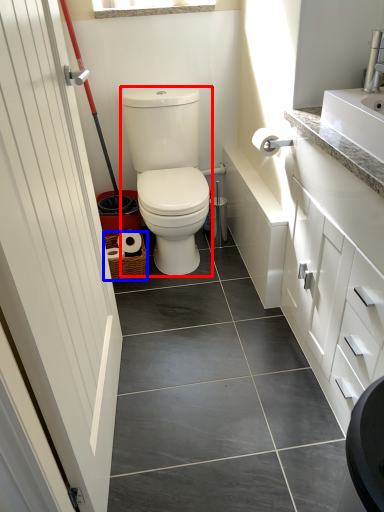
Question: Which of the following is the closest to the observer, sit (highlighted by a red box) or basket (highlighted by a blue box)?

Choices:
 (A) sit
 (B) basket

Answer: (A)